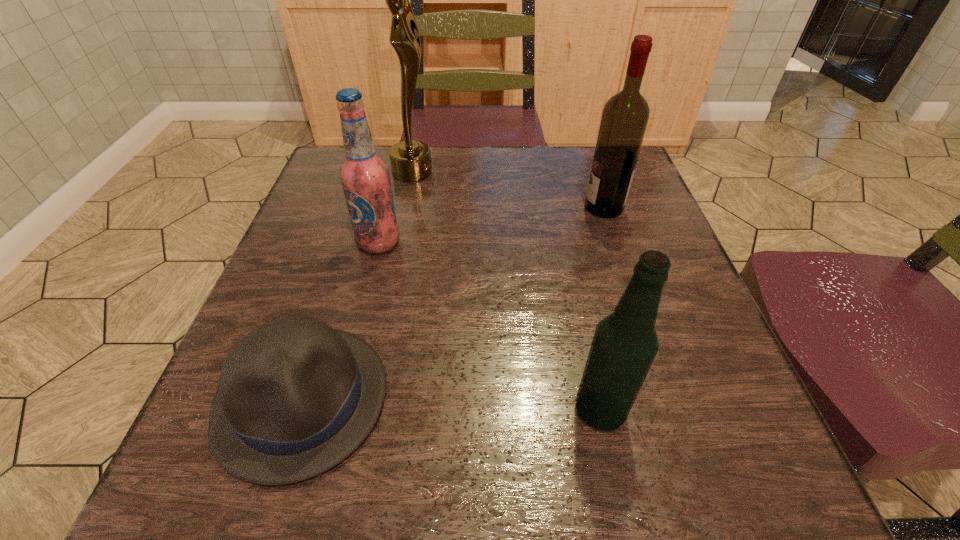
Identify which alcohol is located as the third nearest to the award. Please provide its 2D coordinates. Your answer should be formatted as a tuple, i.e. [(x, y)], where the tuple contains the x and y coordinates of a point satisfying the conditions above.

[(625, 343)]

Identify the location of vacant space that satisfies the following two spatial constraints: 1. on the front-facing side of the fourth object from left to right; 2. on the right side of the award. (364, 410).

The image size is (960, 540). In order to click on vacant region that satisfies the following two spatial constraints: 1. on the front-facing side of the award; 2. on the front-facing side of the shortest object in this screenshot , I will do `click(367, 399)`.

Find the location of a particular element. The width and height of the screenshot is (960, 540). blank area in the image that satisfies the following two spatial constraints: 1. on the front-facing side of the award; 2. on the left side of the fourth object from left to right is located at coordinates (364, 410).

You are a GUI agent. You are given a task and a screenshot of the screen. Output one action in this format:
    pyautogui.click(x=<x>, y=<y>)
    Task: Click on the free space that satisfies the following two spatial constraints: 1. on the front and back of the second farthest object; 2. on the front side of the nearest alcohol
    This screenshot has height=540, width=960.
    Given the screenshot: What is the action you would take?
    pyautogui.click(x=671, y=410)

What are the coordinates of `vacant region that satisfies the following two spatial constraints: 1. on the front-facing side of the farthest object; 2. on the front-facing side of the bowler hat` in the screenshot? It's located at (367, 399).

Identify the location of free location that satisfies the following two spatial constraints: 1. on the front-facing side of the bowler hat; 2. on the left side of the fourth object from left to right. (299, 410).